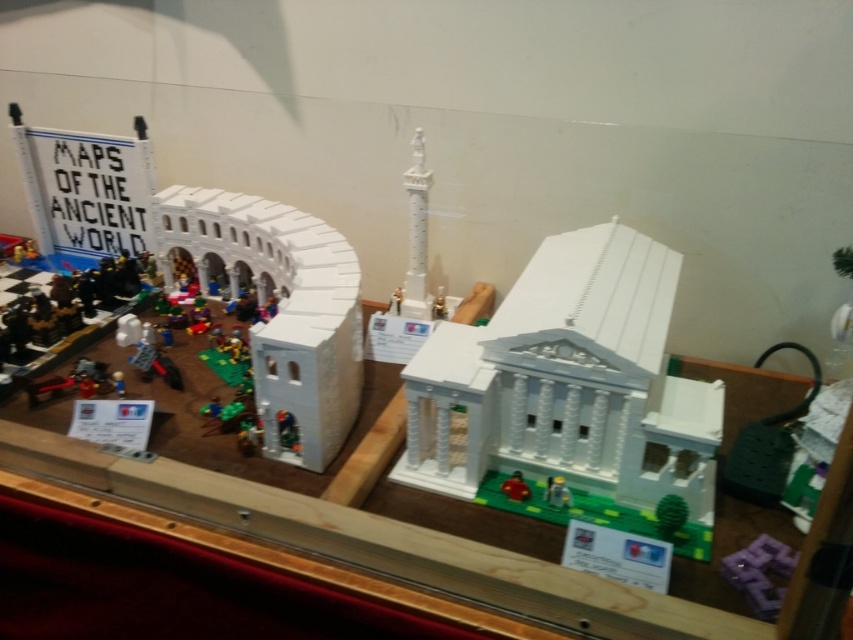
Looking at this image, you are a child who wants to reach the green plastic toy at center from the purple plastic blocks at lower right. Can you estimate how far you need to move to get there?

The purple plastic blocks at lower right is 10.04 inches away from the green plastic toy at center, so you need to move approximately 10.04 inches to reach it.

You are a child who wants to place both the green plastic toy at center and the smooth red car at center on a shelf that can only hold items up to 10 inches wide. Given their widths, can both items fit side by side on the shelf?

The green plastic toy at center is narrower than the smooth red car at center. However, without knowing their exact widths, it is impossible to determine if their combined width exceeds 10 inches. More information is needed.

You are a Lego enthusiast examining the display. You notice the purple plastic blocks at lower right and the green plastic toy at center. Which object is positioned closer to the edge of the display area?

The purple plastic blocks at lower right are closer to the edge of the display area because they are located at the lower right corner, which is typically near the edge, while the green plastic toy at center is positioned in the middle.